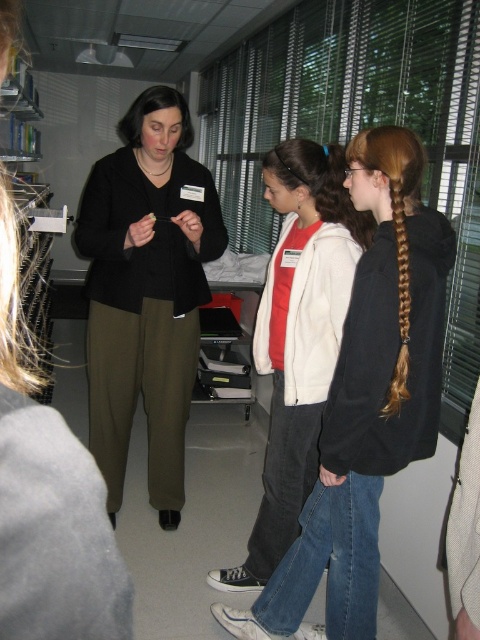
Question: Can you confirm if black matte sweater at center is wider than white matte jacket at center?

Choices:
 (A) no
 (B) yes

Answer: (B)

Question: Does black matte sweater at center appear on the left side of white matte jacket at center?

Choices:
 (A) yes
 (B) no

Answer: (A)

Question: Which point appears closest to the camera in this image?

Choices:
 (A) [145, 205]
 (B) [285, 202]

Answer: (B)

Question: Considering the relative positions of black matte sweater at center and white matte jacket at center in the image provided, where is black matte sweater at center located with respect to white matte jacket at center?

Choices:
 (A) right
 (B) left

Answer: (B)